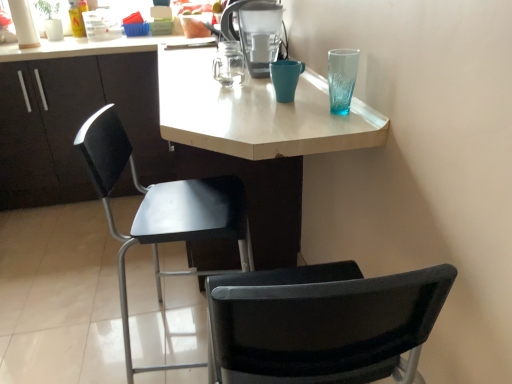
In order to face matte plastic water filter at upper center, should I rotate leftwards or rightwards?

A 0.434 degree turn to the right will do.

Where is `white matte desk at center`? white matte desk at center is located at coordinates (278, 161).

This screenshot has height=384, width=512. What are the coordinates of `black plastic chair at center` in the screenshot? It's located at (161, 209).

From a real-world perspective, between black plastic chair at center and white matte desk at center, who is vertically higher?

white matte desk at center is physically above.

Is white matte desk at center inside black plastic chair at center?

Definitely not — white matte desk at center is not inside black plastic chair at center.

From the image's perspective, does black plastic chair at center appear higher than white matte desk at center?

Incorrect, from the image's perspective, black plastic chair at center is lower than white matte desk at center.

Are matte black cabinet at left and teal ceramic mug at upper center beside each other?

There is a gap between matte black cabinet at left and teal ceramic mug at upper center.

From a real-world perspective, which object rests below the other?

matte black cabinet at left, from a real-world perspective.

Is matte black cabinet at left inside the boundaries of teal ceramic mug at upper center, or outside?

The correct answer is: outside.

In the image, is matte black cabinet at left on the left side or the right side of teal ceramic mug at upper center?

Based on their positions, matte black cabinet at left is located to the left of teal ceramic mug at upper center.

Is white matte desk at center turned away from matte plastic water filter at upper center?

white matte desk at center does not have its back to matte plastic water filter at upper center.

Where is `desk below the matte plastic water filter at upper center (from the image's perspective)`? The height and width of the screenshot is (384, 512). desk below the matte plastic water filter at upper center (from the image's perspective) is located at coordinates (278, 161).

Considering the positions of objects white matte desk at center and matte plastic water filter at upper center in the image provided, who is behind, white matte desk at center or matte plastic water filter at upper center?

matte plastic water filter at upper center.

Which of these two, white matte desk at center or matte plastic water filter at upper center, is bigger?

With larger size is white matte desk at center.

How much distance is there between matte plastic water filter at upper center and teal ceramic mug at upper center?

They are 8.52 inches apart.

How different are the orientations of matte plastic water filter at upper center and teal ceramic mug at upper center in degrees?

They differ by 0.00384 degrees in their facing directions.

Which is closer, (265, 45) or (282, 102)?

Clearly, point (265, 45) is more distant from the camera than point (282, 102).

Is matte plastic water filter at upper center further to the viewer compared to teal ceramic mug at upper center?

Yes, it is behind teal ceramic mug at upper center.

Looking at this image, which is closer to the camera, (46, 83) or (260, 187)?

The point (260, 187) is closer to the camera.

Does matte black cabinet at left have a larger size compared to white matte desk at center?

Actually, matte black cabinet at left might be smaller than white matte desk at center.

From a real-world perspective, who is located lower, matte black cabinet at left or white matte desk at center?

From a 3D spatial view, matte black cabinet at left is below.

You are a GUI agent. You are given a task and a screenshot of the screen. Output one action in this format:
    pyautogui.click(x=<x>, y=<y>)
    Task: Click on the cabinetry on the left of the white matte desk at center
    
    Given the screenshot: What is the action you would take?
    pyautogui.click(x=74, y=124)

Based on their positions, is matte plastic water filter at upper center located to the left or right of matte black cabinet at left?

matte plastic water filter at upper center is to the right of matte black cabinet at left.

Consider the image. From a real-world perspective, is matte plastic water filter at upper center located beneath matte black cabinet at left?

No, from a real-world perspective, matte plastic water filter at upper center is not under matte black cabinet at left.

How different are the orientations of matte plastic water filter at upper center and matte black cabinet at left in degrees?

The angular difference between matte plastic water filter at upper center and matte black cabinet at left is 88.4 degrees.

Considering the relative positions of matte plastic water filter at upper center and matte black cabinet at left in the image provided, is matte plastic water filter at upper center in front of matte black cabinet at left?

Yes, matte plastic water filter at upper center is in front of matte black cabinet at left.

Which is behind, point (153, 158) or point (272, 17)?

The point (153, 158) is more distant.

Is matte black cabinet at left smaller than matte plastic water filter at upper center?

Incorrect, matte black cabinet at left is not smaller in size than matte plastic water filter at upper center.

Is matte plastic water filter at upper center a part of matte black cabinet at left?

Actually, matte plastic water filter at upper center is outside matte black cabinet at left.

The width and height of the screenshot is (512, 384). Find the location of `chair that appears below the white matte desk at center (from a real-world perspective)`. chair that appears below the white matte desk at center (from a real-world perspective) is located at coordinates (161, 209).

This screenshot has height=384, width=512. What are the coordinates of `teal above the matte black cabinet at left (from a real-world perspective)` in the screenshot? It's located at (285, 78).

Which object lies further to the anchor point matte black cabinet at left, black plastic chair at center or white matte desk at center?

black plastic chair at center is further to matte black cabinet at left.

When comparing their distances from white matte desk at center, does matte plastic water filter at upper center or teal ceramic mug at upper center seem further?

teal ceramic mug at upper center is further to white matte desk at center.

Based on their spatial positions, is white matte desk at center or matte plastic water filter at upper center closer to matte black cabinet at left?

The object closer to matte black cabinet at left is white matte desk at center.

When comparing their distances from black plastic chair at center, does matte plastic water filter at upper center or white matte desk at center seem closer?

white matte desk at center is closer to black plastic chair at center.

Looking at the image, which one is located closer to matte plastic water filter at upper center, black plastic chair at center or teal ceramic mug at upper center?

Based on the image, teal ceramic mug at upper center appears to be nearer to matte plastic water filter at upper center.

When comparing their distances from matte plastic water filter at upper center, does teal ceramic mug at upper center or white matte desk at center seem further?

white matte desk at center.

Estimate the real-world distances between objects in this image. Which object is closer to teal ceramic mug at upper center, black plastic chair at center or matte black cabinet at left?

black plastic chair at center.

From the image, which object appears to be farther from matte black cabinet at left, white matte desk at center or black plastic chair at center?

black plastic chair at center is further to matte black cabinet at left.

Image resolution: width=512 pixels, height=384 pixels. Identify the location of chair located between white matte desk at center and matte black cabinet at left in the depth direction. (161, 209).

Identify the location of appliance between matte black cabinet at left and teal ceramic mug at upper center in the horizontal direction. The width and height of the screenshot is (512, 384). (260, 35).

I want to click on appliance located between white matte desk at center and teal ceramic mug at upper center in the left-right direction, so click(x=260, y=35).

Identify the location of chair situated between white matte desk at center and teal ceramic mug at upper center from left to right. This screenshot has height=384, width=512. (161, 209).